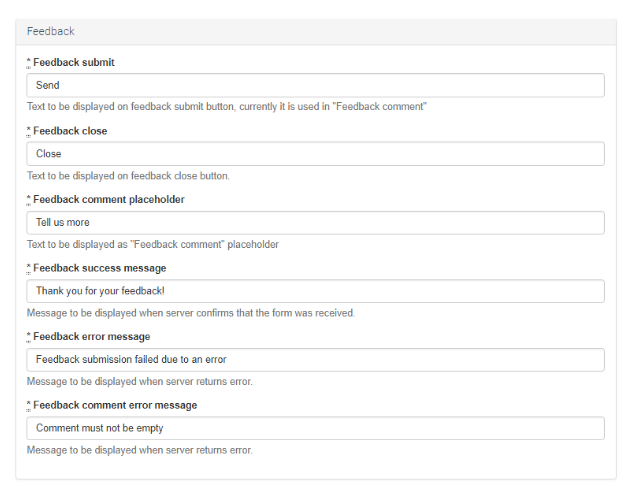
Where is `bar 3`? The width and height of the screenshot is (634, 496). bar 3 is located at coordinates (352, 285).